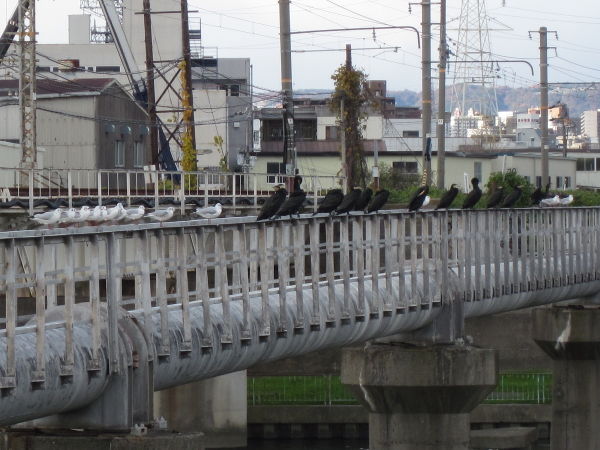
Locate an element on the screen. ladder is located at coordinates (185, 86).